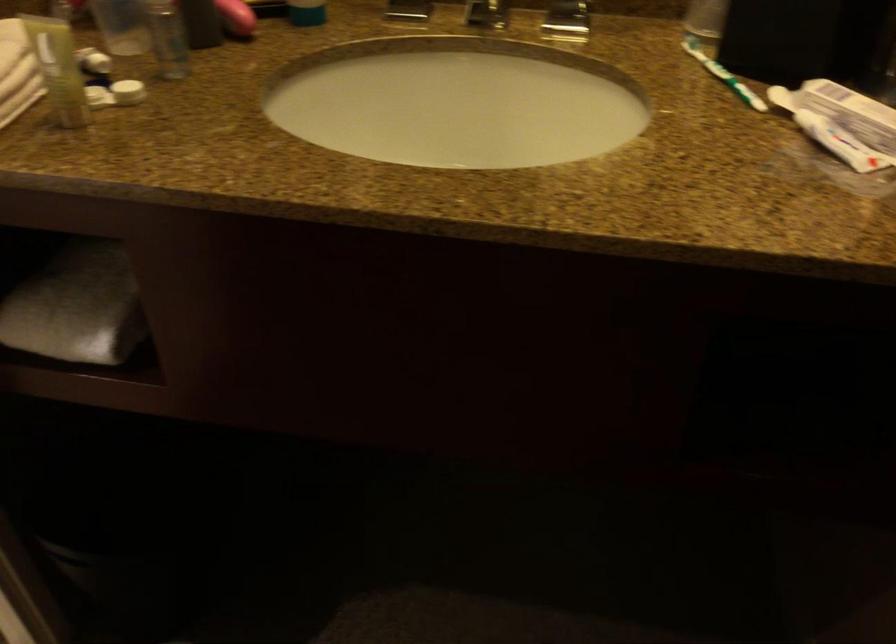
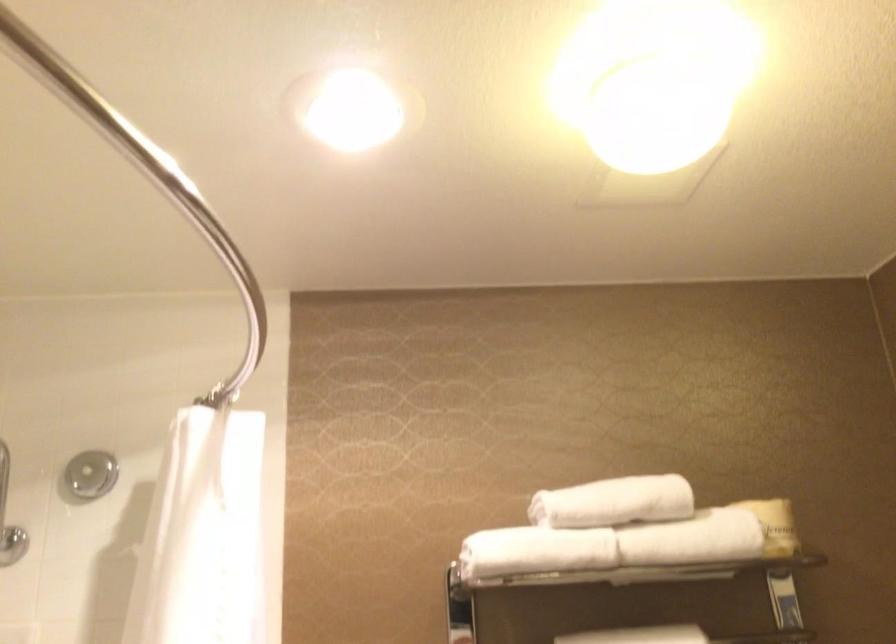
The images are taken continuously from a first-person perspective. In which direction is your viewpoint rotating?

The camera's rotation is toward left-up.